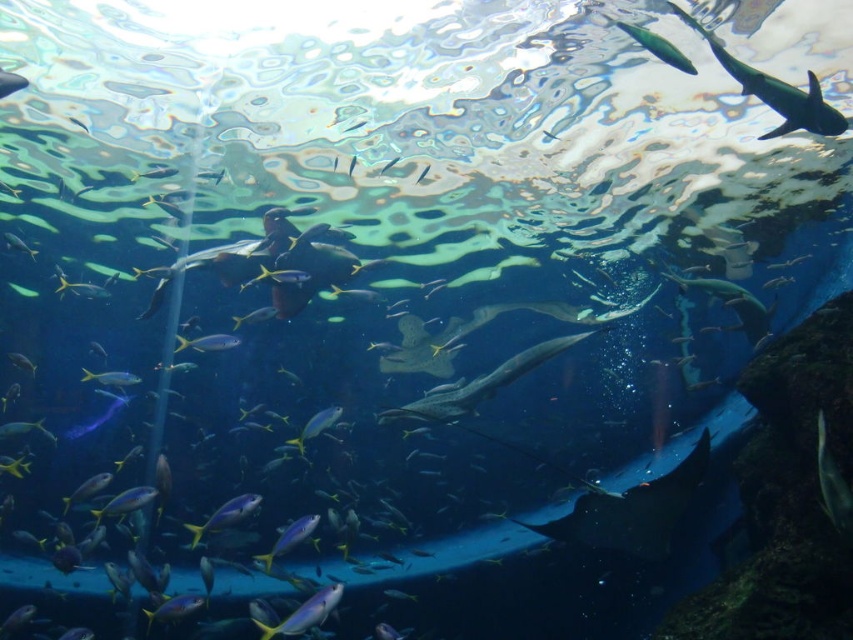
Does point (631, 35) come in front of point (219, 340)?

Yes, it is.

Where is `green glossy fish at upper right`? The height and width of the screenshot is (640, 853). green glossy fish at upper right is located at coordinates (656, 45).

Is shiny silver fish at upper right wider than shiny blue fish at lower center?

Yes.

Does shiny silver fish at upper right have a greater height compared to shiny blue fish at lower center?

Answer: Correct, shiny silver fish at upper right is much taller as shiny blue fish at lower center.

Locate an element on the screen. shiny silver fish at upper right is located at coordinates (775, 90).

Between green glossy fish at upper right and shiny blue fish at center, which one is positioned lower?

shiny blue fish at center

Can you confirm if green glossy fish at upper right is positioned above shiny blue fish at center?

Indeed, green glossy fish at upper right is positioned over shiny blue fish at center.

This screenshot has width=853, height=640. What do you see at coordinates (656, 45) in the screenshot?
I see `green glossy fish at upper right` at bounding box center [656, 45].

The width and height of the screenshot is (853, 640). Find the location of `green glossy fish at upper right`. green glossy fish at upper right is located at coordinates pos(656,45).